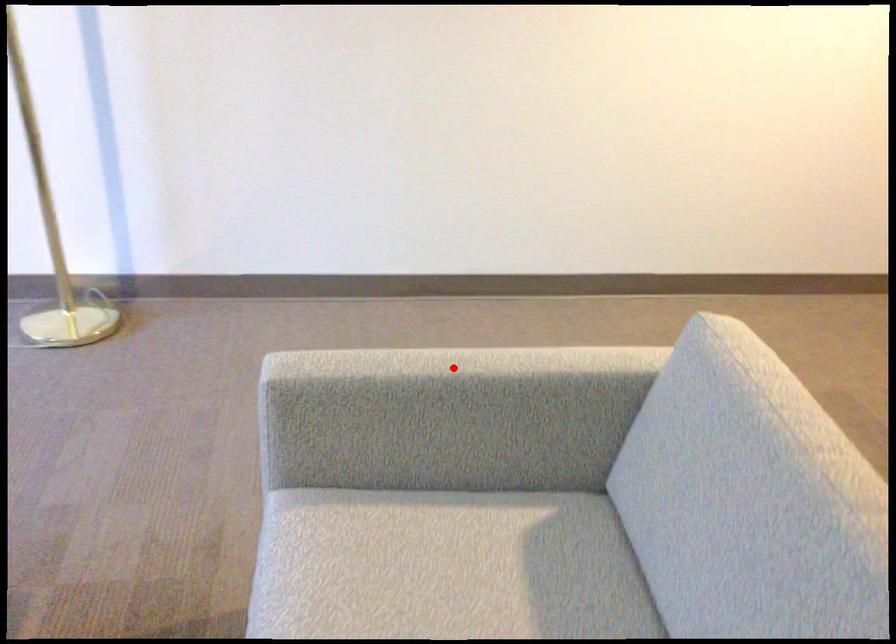
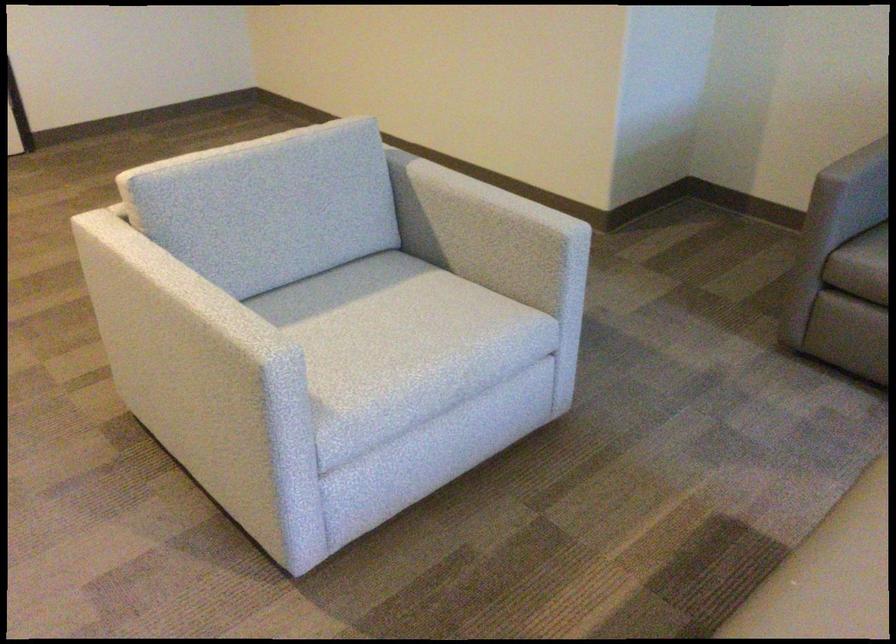
Question: I am providing you with two images of the same scene from different viewpoints. A red point is shown in image1. For the corresponding object point in image2, is it positioned nearer or farther from the camera?

Choices:
 (A) Nearer
 (B) Farther

Answer: (B)